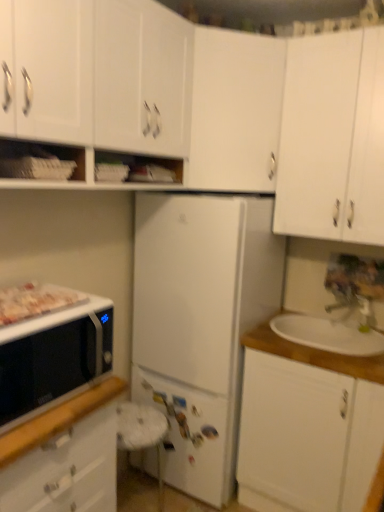
Where is `vacant area that is in front of metallic silver faucet at upper right`? This screenshot has height=512, width=384. vacant area that is in front of metallic silver faucet at upper right is located at coordinates (353, 334).